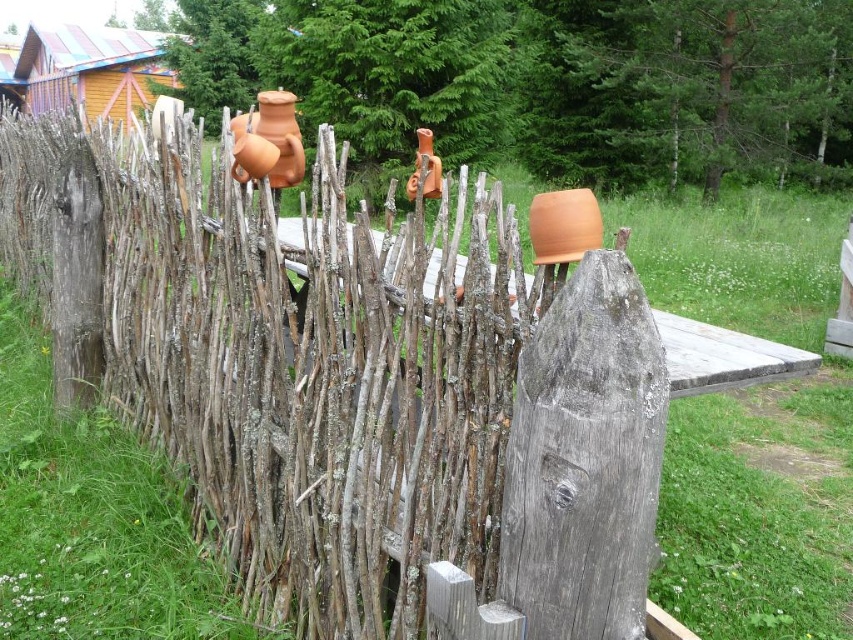
Is rustic wooden fence at center closer to camera compared to matte clay pot at upper center?

That is True.

Does rustic wooden fence at center have a larger size compared to matte clay pot at upper center?

Indeed, rustic wooden fence at center has a larger size compared to matte clay pot at upper center.

Between point (138, 401) and point (286, 112), which one is positioned in front?

Point (286, 112) is more forward.

Identify the location of rustic wooden fence at center. (352, 388).

Is matte clay pot at upper center to the left of matte clay pot at center from the viewer's perspective?

Yes, matte clay pot at upper center is to the left of matte clay pot at center.

Who is more distant from viewer, (x=271, y=99) or (x=541, y=259)?

Positioned behind is point (x=271, y=99).

Is point (260, 154) positioned before point (537, 196)?

No, (260, 154) is further to viewer.

Find the location of a particular element. The width and height of the screenshot is (853, 640). matte clay pot at upper center is located at coordinates (270, 141).

Can you confirm if rustic wooden fence at center is positioned above wooden cabin at upper left?

No, rustic wooden fence at center is not above wooden cabin at upper left.

Image resolution: width=853 pixels, height=640 pixels. I want to click on rustic wooden fence at center, so click(352, 388).

Locate an element on the screen. rustic wooden fence at center is located at coordinates tap(352, 388).